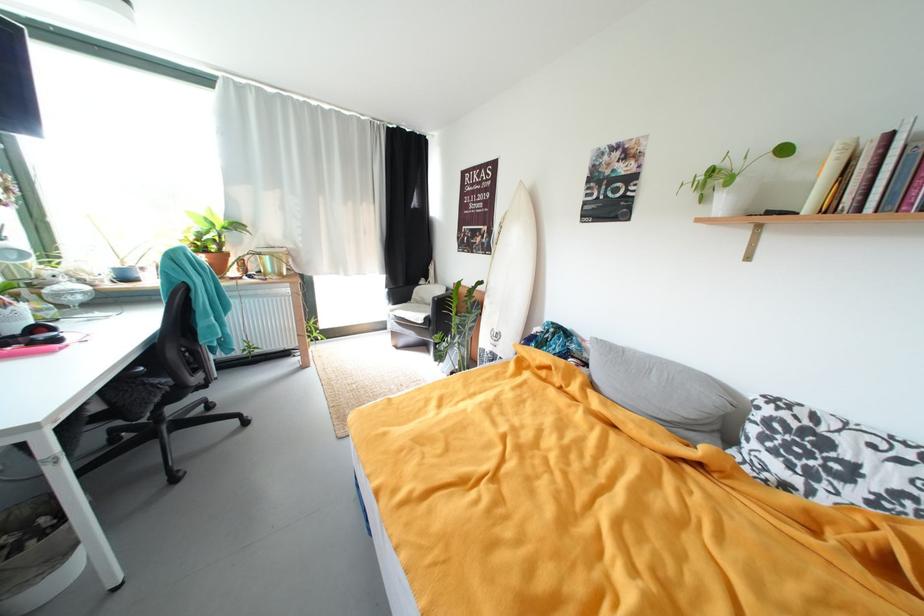
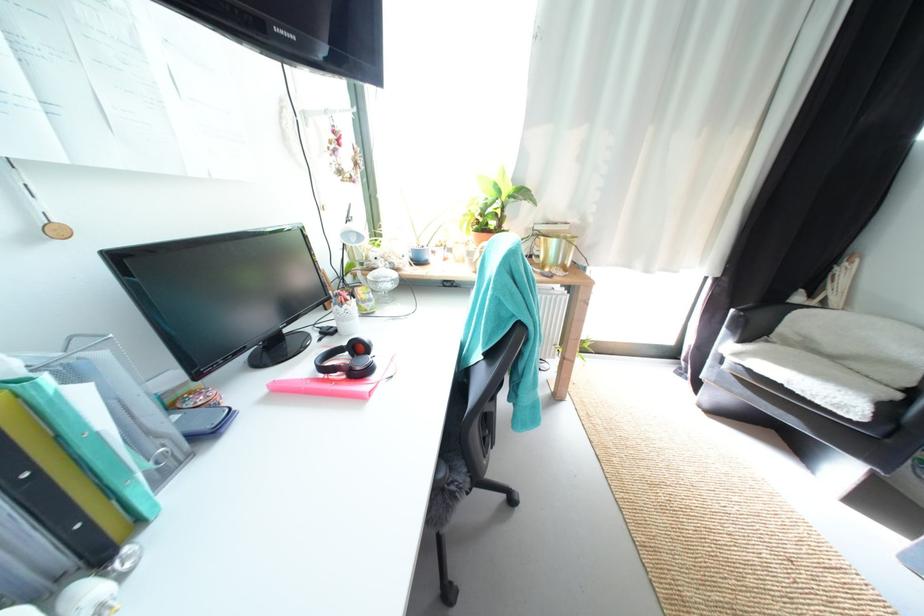
Find the pixel in the second image that matches [56,310] in the first image.

(378, 302)